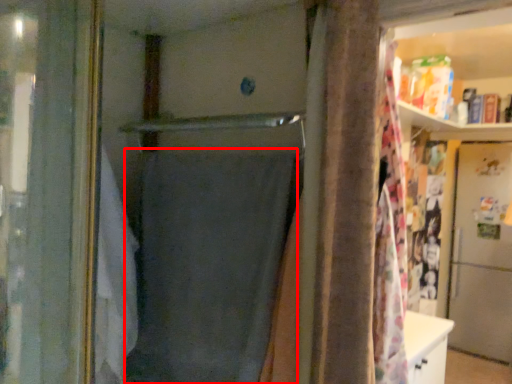
Question: Observing the image, what is the correct spatial positioning of shower curtain (annotated by the red box) in reference to screen door?

Choices:
 (A) left
 (B) right

Answer: (A)